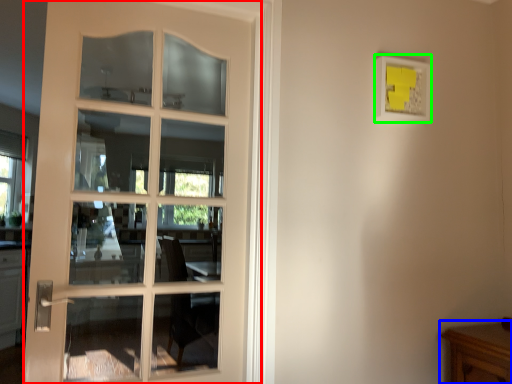
Question: Which object is the closest to the door (highlighted by a red box)? Choose among these: table (highlighted by a blue box) or picture frame (highlighted by a green box).

Choices:
 (A) table
 (B) picture frame

Answer: (B)